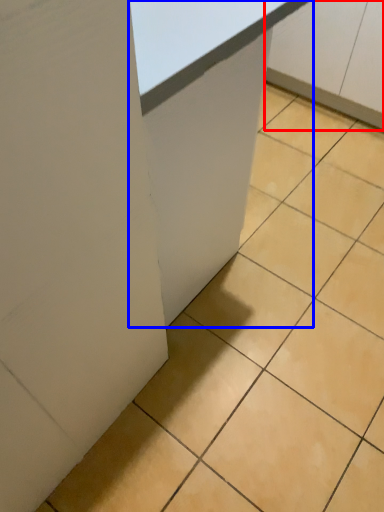
Question: Which point is closer to the camera, cabinetry (highlighted by a red box) or table (highlighted by a blue box)?

Choices:
 (A) cabinetry
 (B) table

Answer: (B)